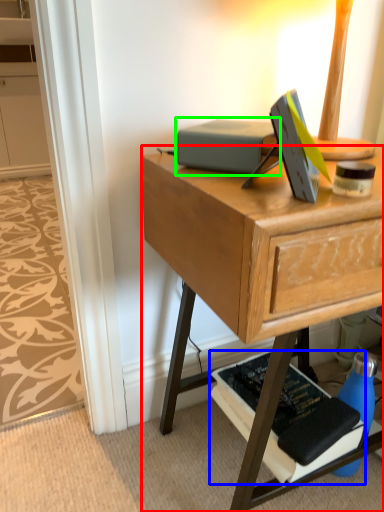
Question: Which object is the farthest from desk (highlighted by a red box)? Choose among these: paperback book (highlighted by a blue box) or paperback book (highlighted by a green box).

Choices:
 (A) paperback book
 (B) paperback book

Answer: (A)